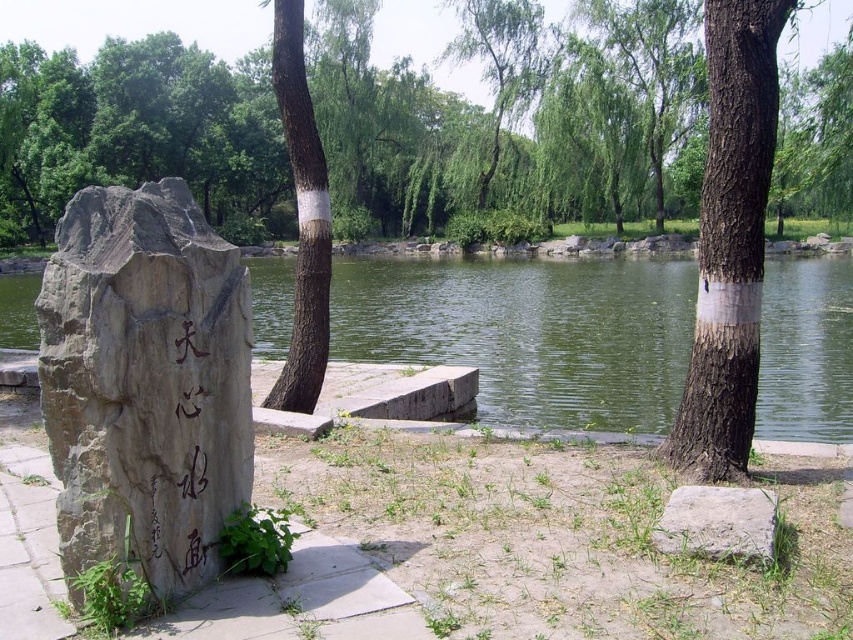
Question: Does green leafy tree at upper center appear on the right side of gray rough stone at lower right?

Choices:
 (A) no
 (B) yes

Answer: (B)

Question: Based on their relative distances, which object is nearer to the brown rough bark tree at right?

Choices:
 (A) green leafy tree at upper center
 (B) brown rough bark tree at center
 (C) gray rough stone at lower right

Answer: (C)

Question: In this image, where is brown rough bark tree at right located relative to brown rough bark tree at center?

Choices:
 (A) below
 (B) above

Answer: (A)

Question: In this image, where is brown rough bark tree at right located relative to brown rough bark tree at center?

Choices:
 (A) left
 (B) right

Answer: (B)

Question: Which point is farther to the camera?

Choices:
 (A) (300, 115)
 (B) (709, 442)

Answer: (A)

Question: Which point is farther to the camera?

Choices:
 (A) (764, 109)
 (B) (492, 131)

Answer: (B)